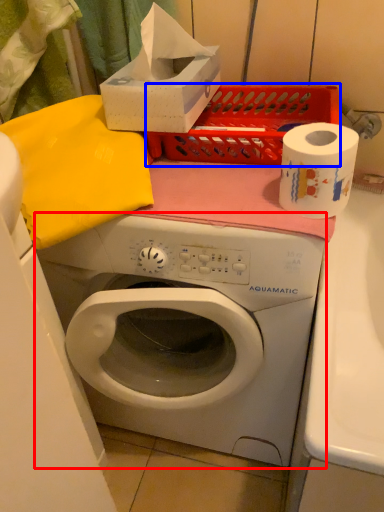
Question: Which point is closer to the camera, washing machine (highlighted by a red box) or crate (highlighted by a blue box)?

Choices:
 (A) washing machine
 (B) crate

Answer: (A)